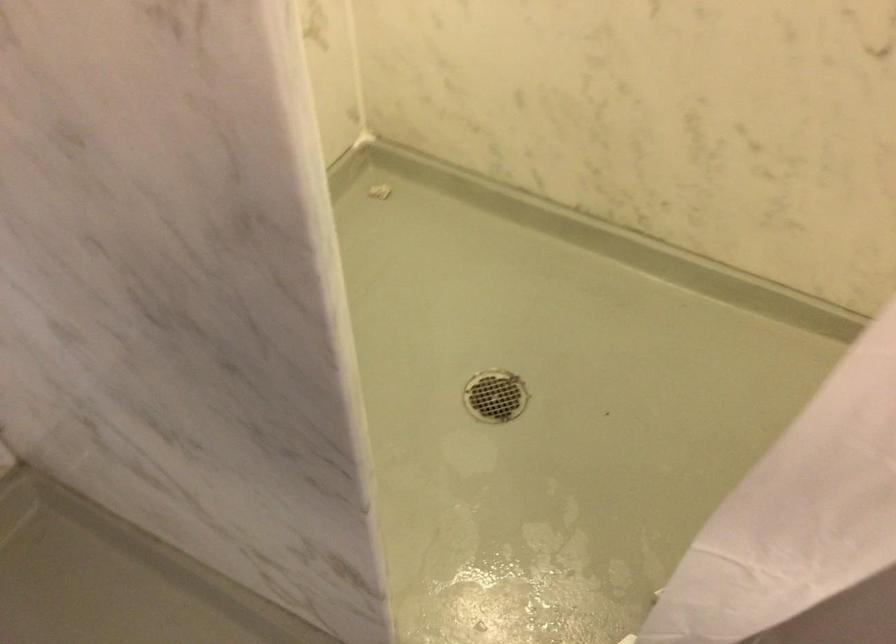
The first image is from the beginning of the video and the second image is from the end. How did the camera likely rotate when shooting the video?

The rotation direction of the camera is right-down.